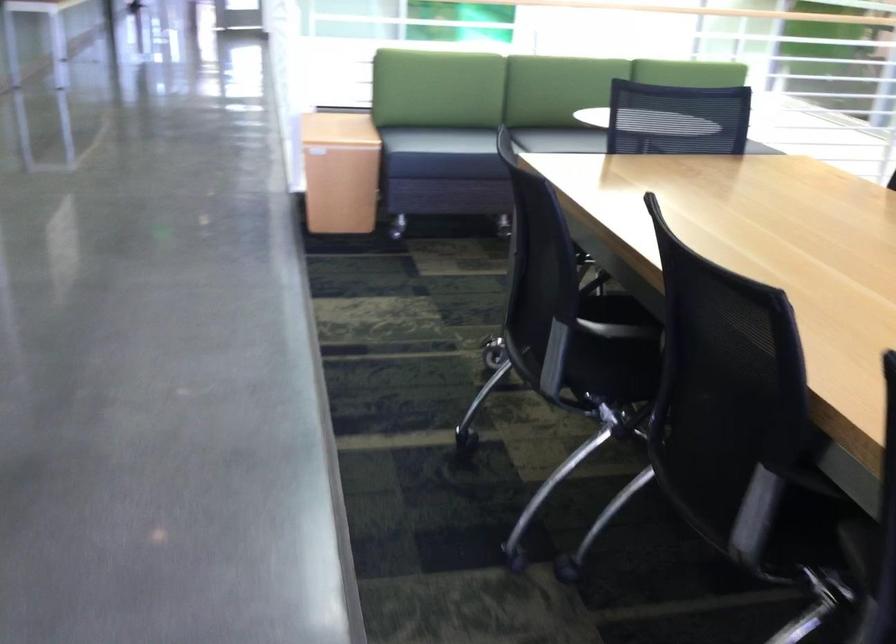
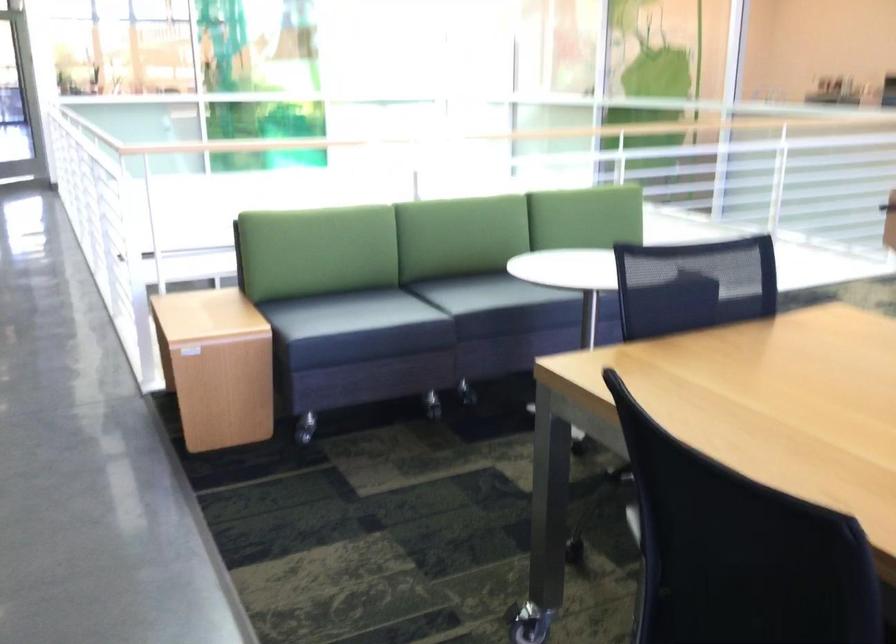
The point at (681, 114) is marked in the first image. Where is the corresponding point in the second image?

(695, 275)